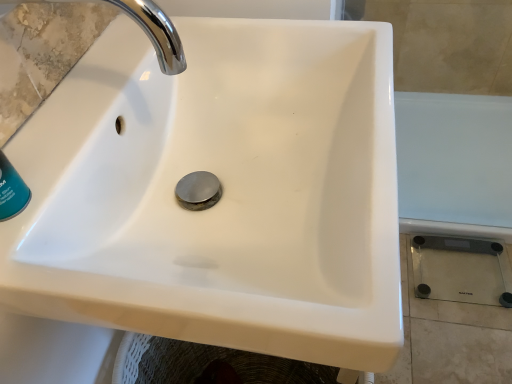
Measure the distance between point [170,34] and camera.

They are 17.36 inches apart.

The image size is (512, 384). In order to click on chrome metallic faucet at upper left in this screenshot , I will do `click(156, 32)`.

What is the approximate width of chrome metallic faucet at upper left?

It is 9.25 inches.

The height and width of the screenshot is (384, 512). What do you see at coordinates (156, 32) in the screenshot?
I see `chrome metallic faucet at upper left` at bounding box center [156, 32].

Where is `chrome metallic faucet at upper left`? This screenshot has width=512, height=384. chrome metallic faucet at upper left is located at coordinates (156, 32).